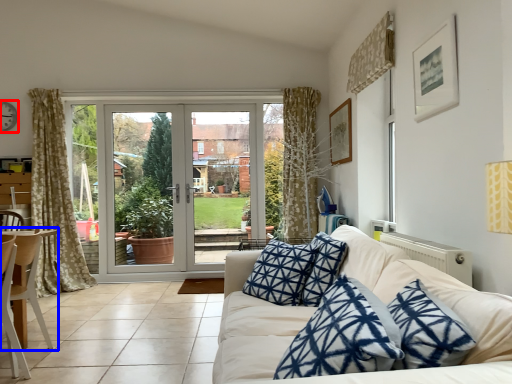
Question: Which object appears farthest to the camera in this image, clock (highlighted by a red box) or chair (highlighted by a blue box)?

Choices:
 (A) clock
 (B) chair

Answer: (A)